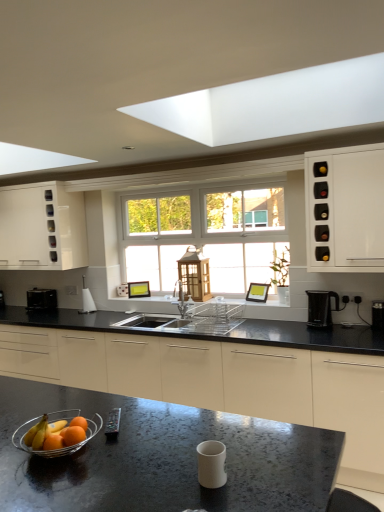
Question: Considering their positions, is white matte cup at center, the fifth appliance when ordered from back to front, located in front of or behind white glossy trash can at left, which is counted as the 2th appliance, starting from the back?

Choices:
 (A) behind
 (B) front

Answer: (B)

Question: From the image's perspective, relative to white glossy trash can at left, the 4th appliance in the front-to-back sequence, is white matte cup at center, the first appliance when ordered from front to back, above or below?

Choices:
 (A) below
 (B) above

Answer: (A)

Question: Which is nearer to the clear glass bowl at lower left?

Choices:
 (A) black plastic coffee machine at right
 (B) white glossy cabinet at upper left, positioned as the second cabinetry in right-to-left order
 (C) metallic remote control at center, which ranks as the 3th appliance in left-to-right order
 (D) metallic silver faucet at center
 (E) matte black toaster at left, acting as the 1th appliance starting from the back

Answer: (C)

Question: Which of these objects is positioned farthest from the black plastic coffee maker at right, which is the 1th appliance in right-to-left order?

Choices:
 (A) white glossy cabinet at upper left, positioned as the second cabinetry in right-to-left order
 (B) matte black toaster at left, which is counted as the 1th appliance, starting from the left
 (C) white matte cup at center, the fourth appliance positioned from the left
 (D) white glossy cabinet at right, acting as the second cabinetry starting from the back
 (E) black granite countertop at center

Answer: (A)